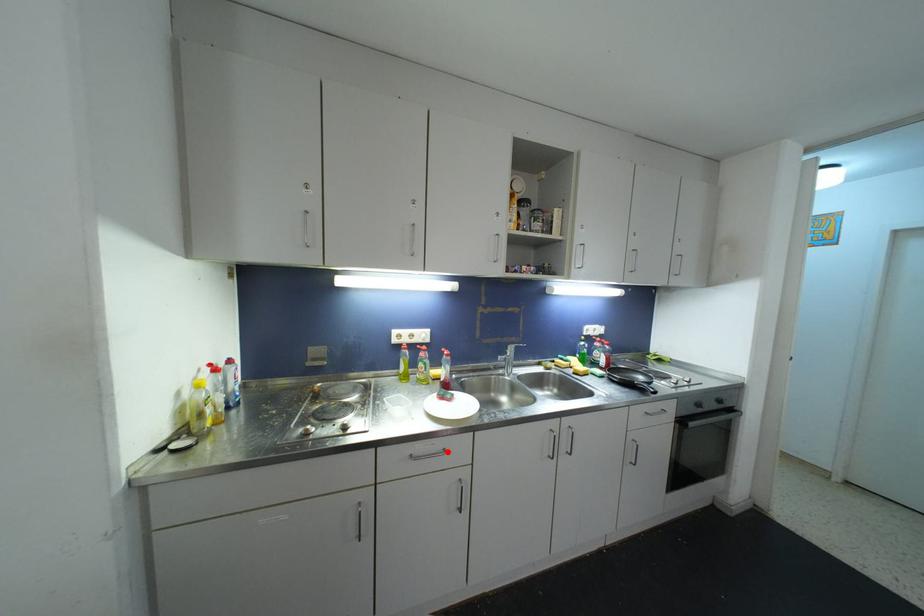
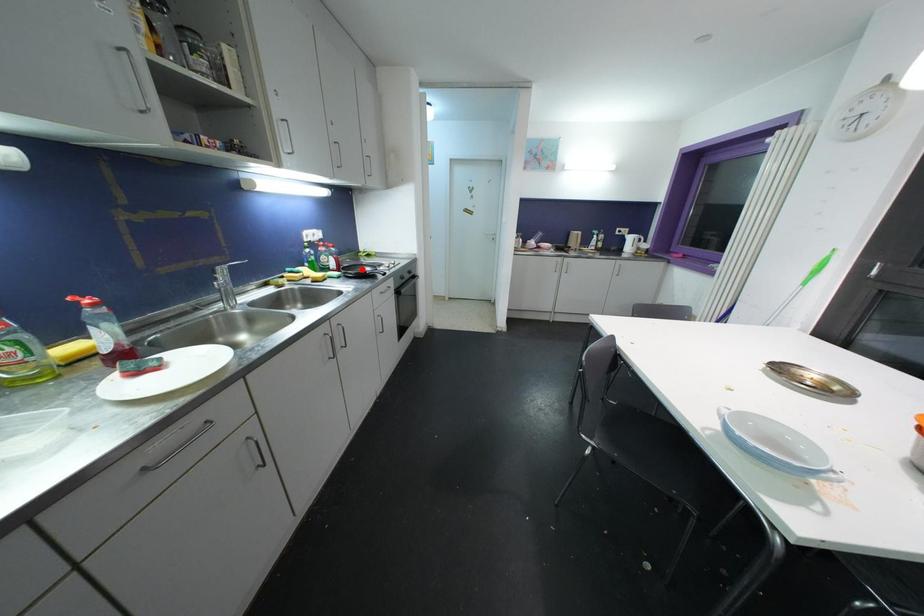
I am providing you with two images of the same scene from different viewpoints. A red point is marked on the first image and another point is marked on the second image. Is the red point in image1 aligned with the point shown in image2?

No